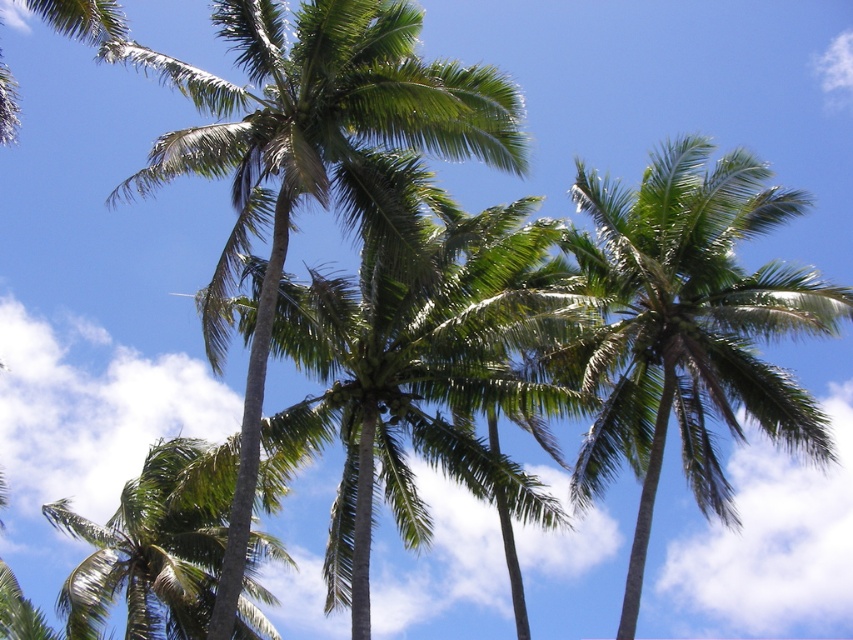
You are standing at the base of the green leafy palm tree at center and want to look up to see the green leafy palm tree at upper right. Which tree will appear taller in your view?

The green leafy palm tree at upper right appears smaller in size compared to the green leafy palm tree at center, so the tree at center will look taller in your view.

You are standing at the base of the green leafy palm tree at center and want to walk towards the green leafy palm tree at upper right. In which direction should you head?

You should head to the right because the green leafy palm tree at upper right is positioned to the right of the green leafy palm tree at center.

You are standing at the base of the palm trees in the image and want to estimate how far the green leafy palm tree at upper right is from you. Based on the scene, can you determine its approximate distance?

The green leafy palm tree at upper right is approximately 72.93 feet away from the viewer.